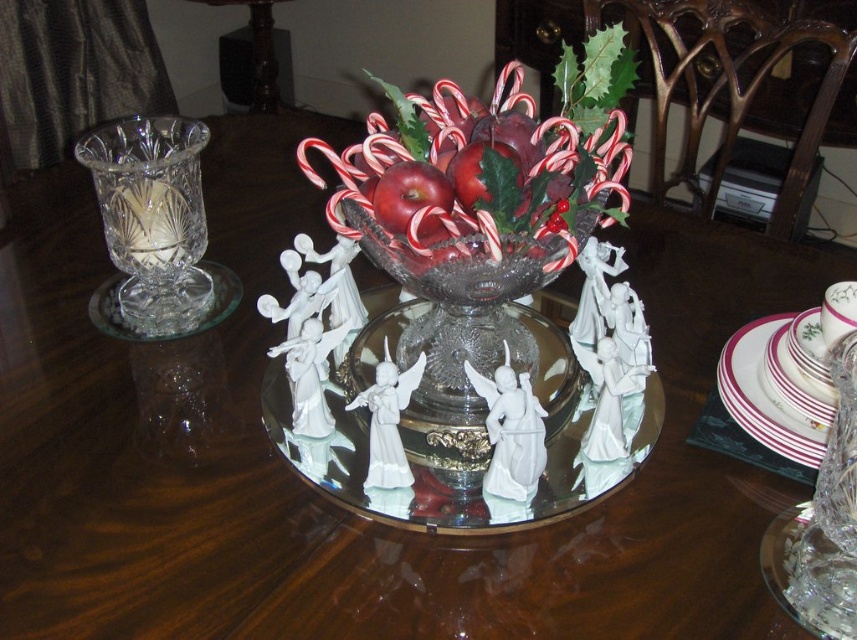
You are standing at the edge of the table where the festive centerpiece is placed. You notice two points marked on the table surface. The first point is at coordinate point (517,259) and the second is at point (409,214). If you want to place a small decoration closer to you, which point should you choose?

Point (517,259) is closer to the viewer than point (409,214), so you should choose point (517,259) to place the small decoration closer to you.

You are a guest at a holiday party and notice the transparent glass bowl at center and the red glossy apple at center on the table. Which object is located to the right of the other?

The transparent glass bowl at center is positioned on the right side of red glossy apple at center, so the transparent glass bowl at center is to the right of the red glossy apple at center.